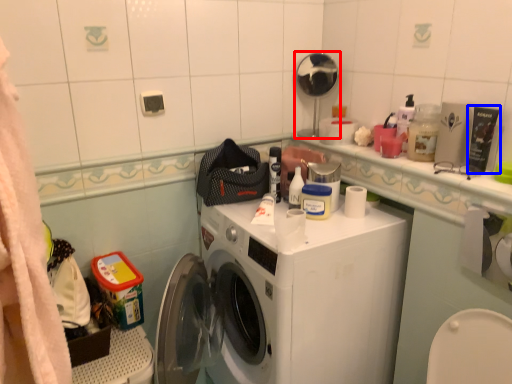
Question: Which object appears farthest to the camera in this image, shower (highlighted by a red box) or toiletry (highlighted by a blue box)?

Choices:
 (A) shower
 (B) toiletry

Answer: (A)